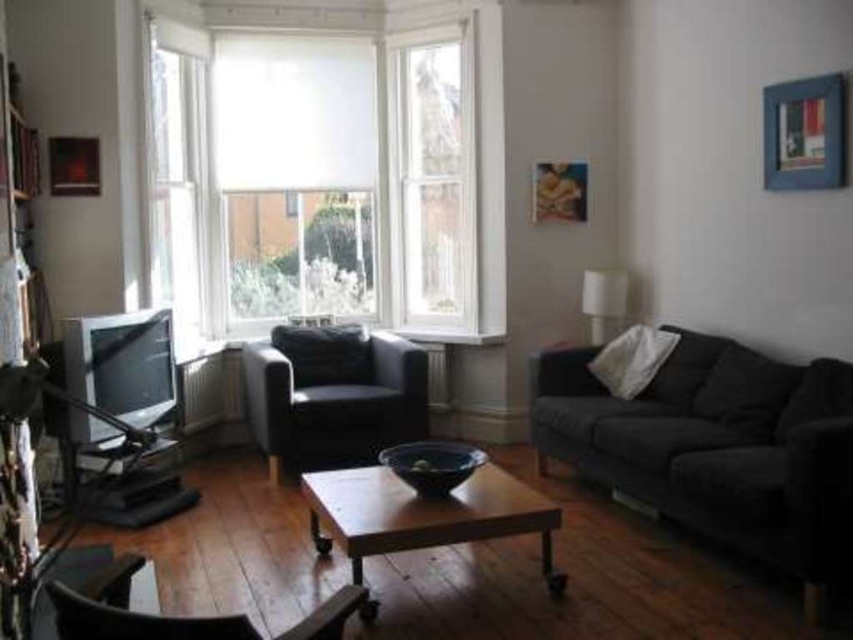
Is dark gray fabric couch at right below dark gray leather armchair at center?

Yes.

Who is higher up, dark gray fabric couch at right or dark gray leather armchair at center?

dark gray leather armchair at center is above.

Is point (639, 467) positioned in front of point (264, 436)?

Yes, point (639, 467) is in front of point (264, 436).

This screenshot has width=853, height=640. In order to click on dark gray fabric couch at right in this screenshot , I will do `click(718, 451)`.

Is point (305, 280) positioned before point (357, 605)?

No.

Does white matte window at center have a lesser width compared to matte black chair at lower left?

No, white matte window at center is not thinner than matte black chair at lower left.

Is point (294, 188) positioned in front of point (138, 634)?

No, (294, 188) is behind (138, 634).

Image resolution: width=853 pixels, height=640 pixels. I want to click on white matte window at center, so click(x=318, y=173).

Can you confirm if white matte window at center is positioned to the right of wooden coffee table at center?

Incorrect, white matte window at center is not on the right side of wooden coffee table at center.

Where is `white matte window at center`? The image size is (853, 640). white matte window at center is located at coordinates (318, 173).

At what (x,y) coordinates should I click in order to perform the action: click on white matte window at center. Please return your answer as a coordinate pair (x, y). The width and height of the screenshot is (853, 640). Looking at the image, I should click on (318, 173).